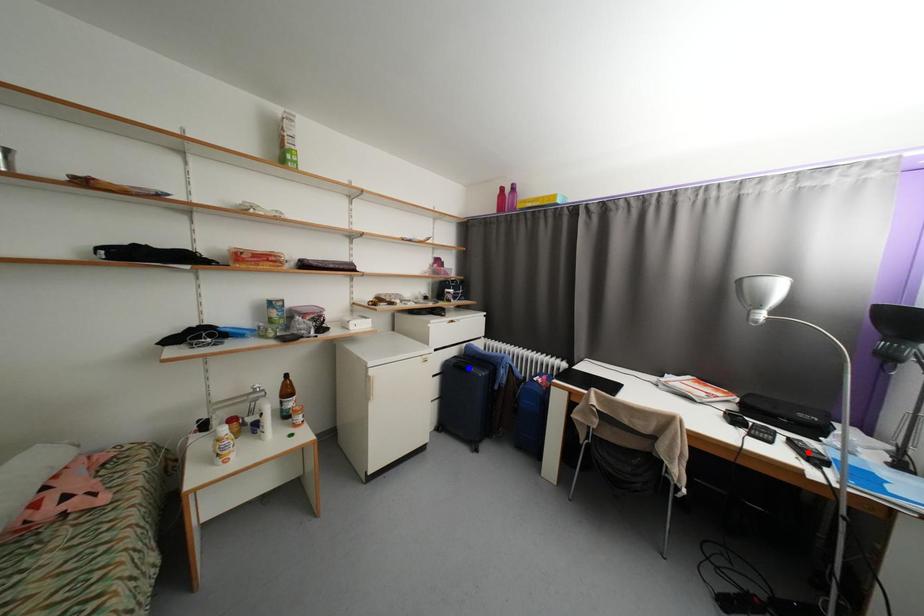
Question: In the image, two points are highlighted. Which point is nearer to the camera? Reply with the corresponding letter.

Choices:
 (A) blue point
 (B) red point

Answer: (B)